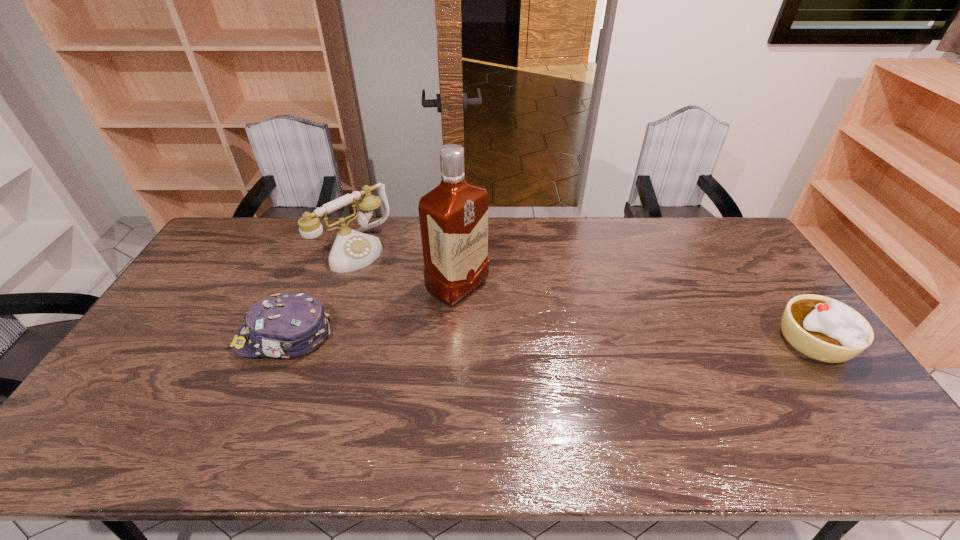
You are a GUI agent. You are given a task and a screenshot of the screen. Output one action in this format:
    pyautogui.click(x=<x>, y=<y>)
    Task: Click on the vacant area that lies between the telephone and the rightmost object
    The width and height of the screenshot is (960, 540).
    Given the screenshot: What is the action you would take?
    pyautogui.click(x=584, y=295)

At what (x,y) coordinates should I click in order to perform the action: click on empty location between the headwear and the whipped cream. Please return your answer as a coordinate pair (x, y). Looking at the image, I should click on [549, 339].

Locate which object ranks in proximity to the rightmost object. Please provide its 2D coordinates. Your answer should be formatted as a tuple, i.e. [(x, y)], where the tuple contains the x and y coordinates of a point satisfying the conditions above.

[(453, 216)]

The height and width of the screenshot is (540, 960). Find the location of `the third closest object to the second tallest object`. the third closest object to the second tallest object is located at coordinates (824, 329).

Where is `vacant space that satisfies the following two spatial constraints: 1. on the front side of the third tallest object; 2. on the left side of the telephone`? vacant space that satisfies the following two spatial constraints: 1. on the front side of the third tallest object; 2. on the left side of the telephone is located at coordinates (323, 340).